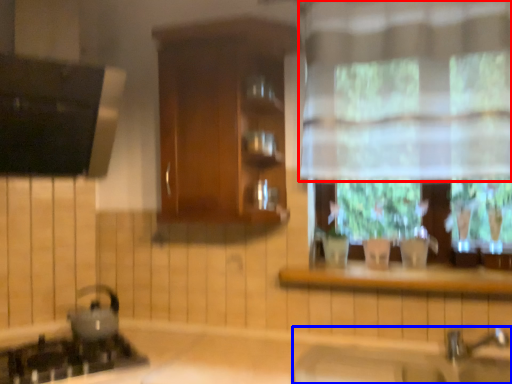
Question: Which point is further to the camera, curtain (highlighted by a red box) or sink (highlighted by a blue box)?

Choices:
 (A) curtain
 (B) sink

Answer: (A)